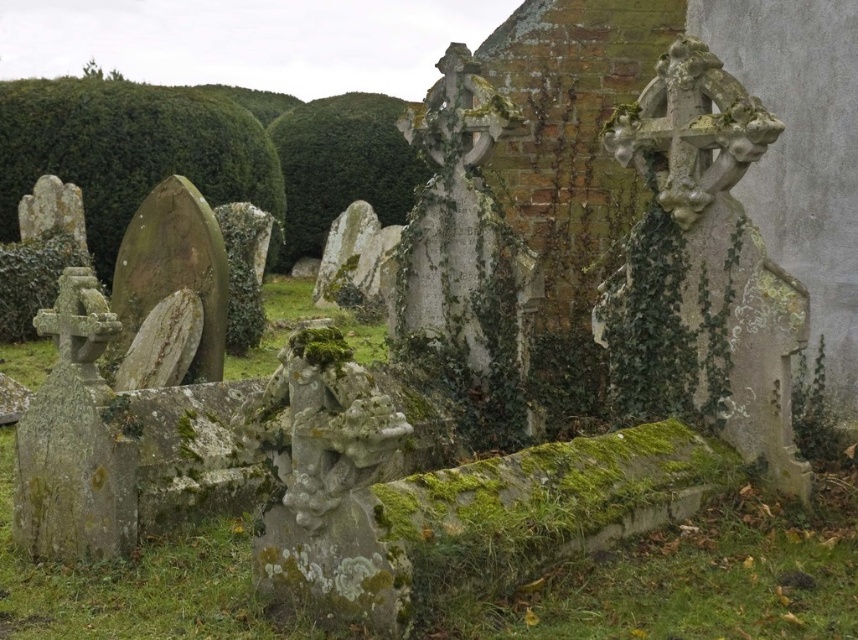
Question: Which of the following is the closest to the observer?

Choices:
 (A) (94, 256)
 (B) (408, 154)

Answer: (A)

Question: Among these points, which one is farthest from the camera?

Choices:
 (A) (228, 104)
 (B) (319, 172)

Answer: (B)

Question: Is green mossy hedge at upper left behind green leafy hedge at upper center?

Choices:
 (A) yes
 (B) no

Answer: (B)

Question: Among these objects, which one is nearest to the camera?

Choices:
 (A) green leafy hedge at upper center
 (B) green mossy hedge at upper left

Answer: (B)

Question: Is green mossy hedge at upper left to the right of green leafy hedge at upper center from the viewer's perspective?

Choices:
 (A) yes
 (B) no

Answer: (B)

Question: Is green mossy hedge at upper left closer to the viewer compared to green leafy hedge at upper center?

Choices:
 (A) yes
 (B) no

Answer: (A)